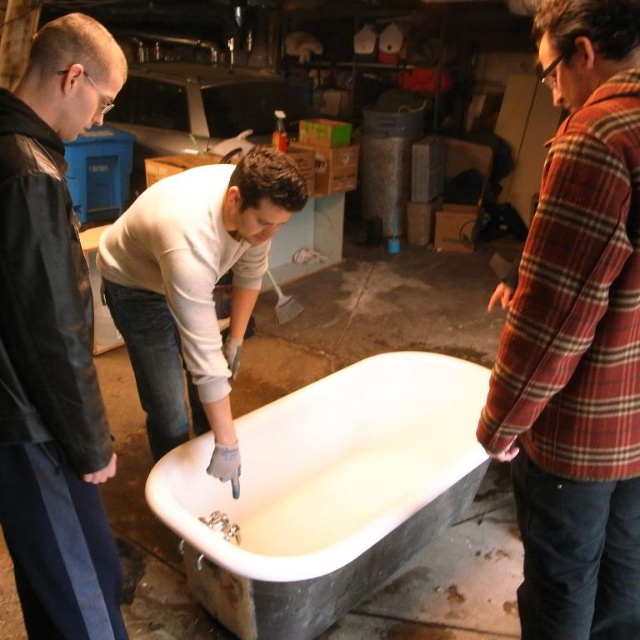
Question: Can you confirm if white glossy bathtub at center is bigger than white matte bathtub at center?

Choices:
 (A) no
 (B) yes

Answer: (B)

Question: Estimate the real-world distances between objects in this image. Which object is farther from the white glossy bathtub at center?

Choices:
 (A) red plaid shirt at right
 (B) black leather jacket at left

Answer: (A)

Question: Does red plaid shirt at right have a lesser width compared to white matte bathtub at center?

Choices:
 (A) yes
 (B) no

Answer: (A)

Question: Is white glossy bathtub at center above black leather jacket at left?

Choices:
 (A) no
 (B) yes

Answer: (A)

Question: Which object is positioned farthest from the white glossy bathtub at center?

Choices:
 (A) black leather jacket at left
 (B) white matte bathtub at center
 (C) red plaid shirt at right

Answer: (C)

Question: Which point is closer to the camera?

Choices:
 (A) (577, 65)
 (B) (45, 346)
 (C) (248, 445)
 (D) (236, 189)

Answer: (A)